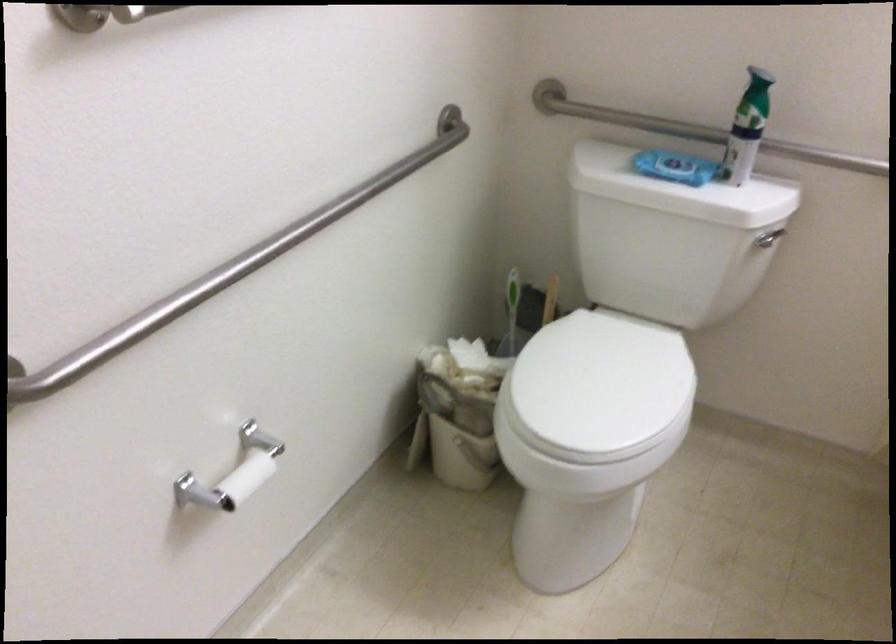
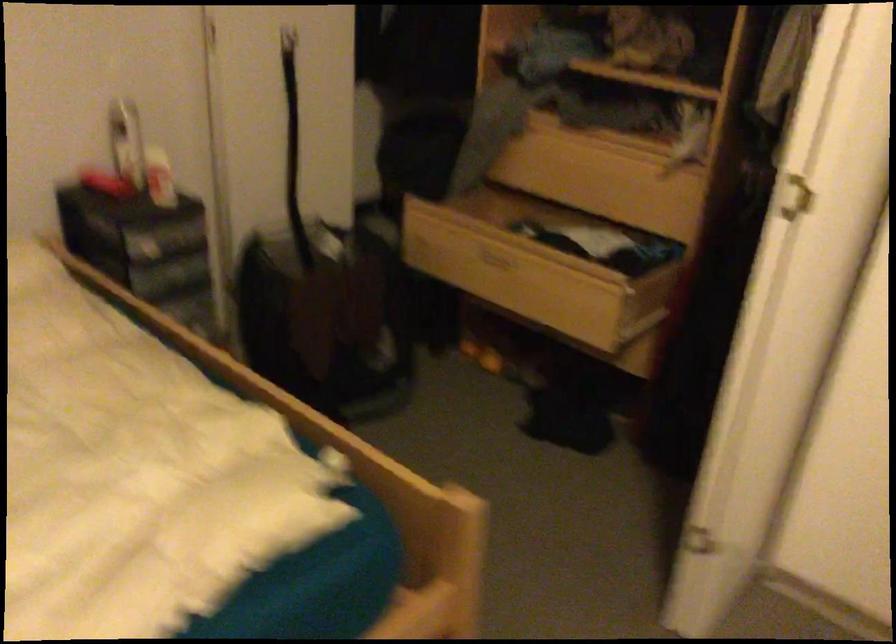
Question: I am providing you with two images of the same scene from different viewpoints. After the viewpoint changes to image2, which objects are now occluded?

Choices:
 (A) white door handle
 (B) small white bucket
 (C) open wooden drawer
 (D) wooden speaker

Answer: (B)